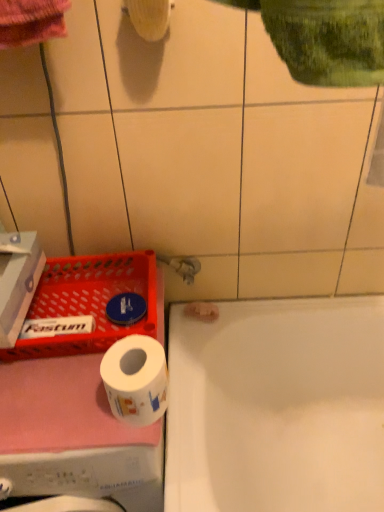
Question: Is white cardboard box at left positioned with its back to red plastic tray at lower left?

Choices:
 (A) yes
 (B) no

Answer: (B)

Question: Considering the relative sizes of white cardboard box at left and red plastic tray at lower left in the image provided, is white cardboard box at left smaller than red plastic tray at lower left?

Choices:
 (A) yes
 (B) no

Answer: (A)

Question: Would you consider white cardboard box at left to be distant from red plastic tray at lower left?

Choices:
 (A) yes
 (B) no

Answer: (B)

Question: Does white cardboard box at left contain red plastic tray at lower left?

Choices:
 (A) yes
 (B) no

Answer: (B)

Question: Does white cardboard box at left have a larger size compared to red plastic tray at lower left?

Choices:
 (A) yes
 (B) no

Answer: (B)

Question: Does white cardboard box at left have a greater width compared to red plastic tray at lower left?

Choices:
 (A) no
 (B) yes

Answer: (A)

Question: Does white matte toilet paper at lower left have a smaller size compared to white glossy washing machine at lower left?

Choices:
 (A) yes
 (B) no

Answer: (A)

Question: Is white matte toilet paper at lower left in front of white glossy washing machine at lower left?

Choices:
 (A) yes
 (B) no

Answer: (B)

Question: Is white matte toilet paper at lower left at the left side of white glossy washing machine at lower left?

Choices:
 (A) no
 (B) yes

Answer: (A)

Question: Does white matte toilet paper at lower left have a lesser width compared to white glossy washing machine at lower left?

Choices:
 (A) yes
 (B) no

Answer: (A)

Question: Is white matte toilet paper at lower left shorter than white glossy washing machine at lower left?

Choices:
 (A) yes
 (B) no

Answer: (A)

Question: From a real-world perspective, does white matte toilet paper at lower left sit lower than white glossy washing machine at lower left?

Choices:
 (A) yes
 (B) no

Answer: (B)

Question: Is white glossy washing machine at lower left placed right next to white glossy bathtub at lower right?

Choices:
 (A) yes
 (B) no

Answer: (B)